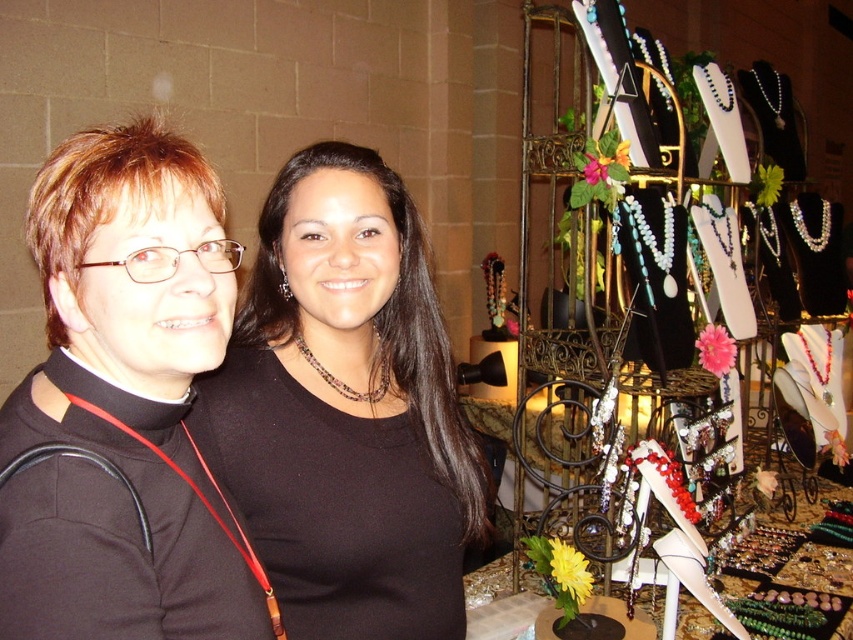
Between matte black necklace at center and black matte/black turtleneck at center, which one has more height?

matte black necklace at center is taller.

This screenshot has height=640, width=853. Find the location of `matte black necklace at center`. matte black necklace at center is located at coordinates (346, 410).

The width and height of the screenshot is (853, 640). What are the coordinates of `matte black necklace at center` in the screenshot? It's located at (346, 410).